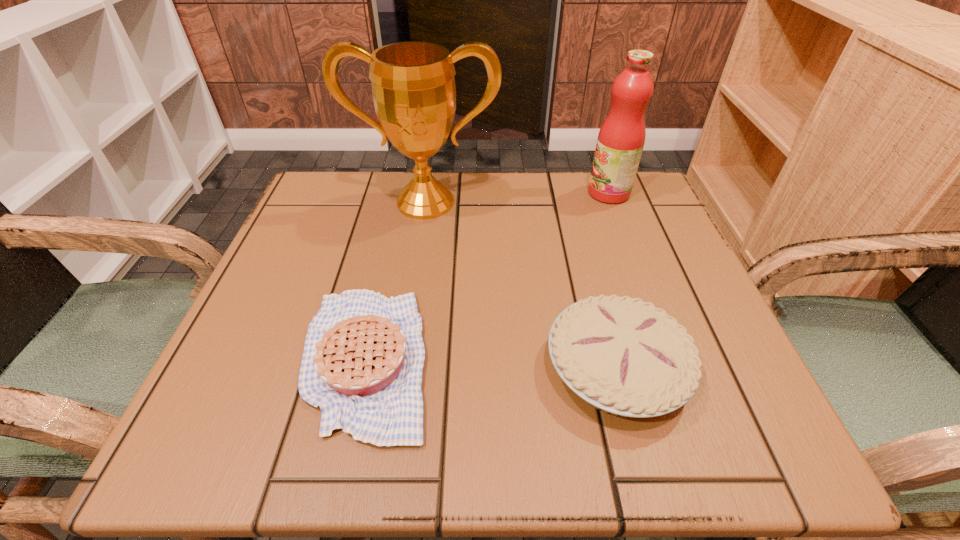
Locate an element on the screen. The image size is (960, 540). free space between the left pie and the fruit juice is located at coordinates (488, 276).

The image size is (960, 540). I want to click on free spot between the right pie and the award, so click(x=520, y=285).

Identify the location of free space between the award and the shorter pie. This screenshot has height=540, width=960. pos(396,281).

Where is `empty location between the award and the fruit juice`? This screenshot has height=540, width=960. empty location between the award and the fruit juice is located at coordinates pyautogui.click(x=517, y=198).

Locate an element on the screen. vacant space that is in between the right pie and the left pie is located at coordinates (491, 364).

Where is `free space between the shorter pie and the fruit juice`? Image resolution: width=960 pixels, height=540 pixels. free space between the shorter pie and the fruit juice is located at coordinates (488, 276).

Identify the location of empty space between the fruit juice and the award. This screenshot has width=960, height=540. (517, 198).

This screenshot has height=540, width=960. I want to click on vacant region between the award and the third tallest object, so click(x=520, y=285).

Locate an element on the screen. free spot between the fruit juice and the award is located at coordinates pyautogui.click(x=517, y=198).

Select which object appears as the closest to the left pie. Please provide its 2D coordinates. Your answer should be formatted as a tuple, i.e. [(x, y)], where the tuple contains the x and y coordinates of a point satisfying the conditions above.

[(624, 356)]